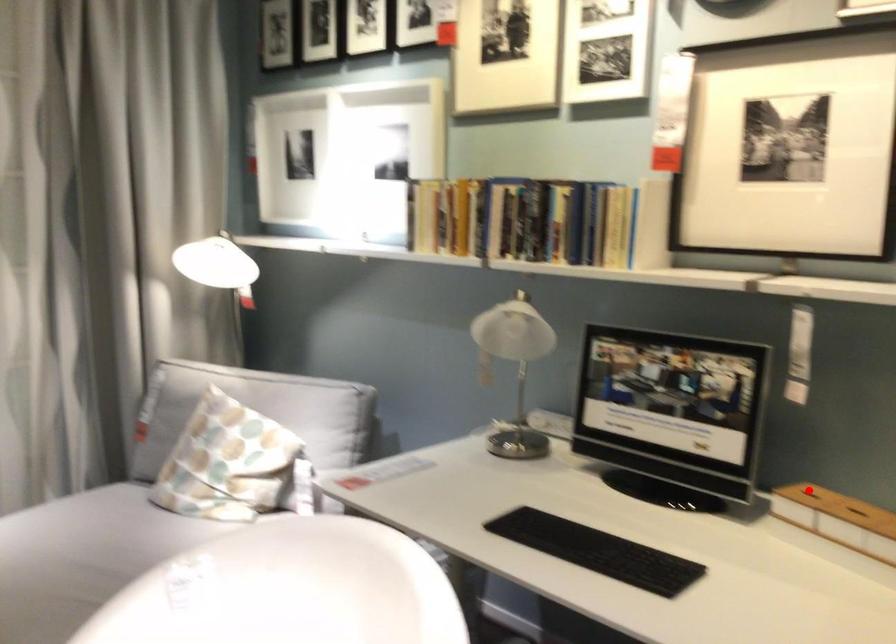
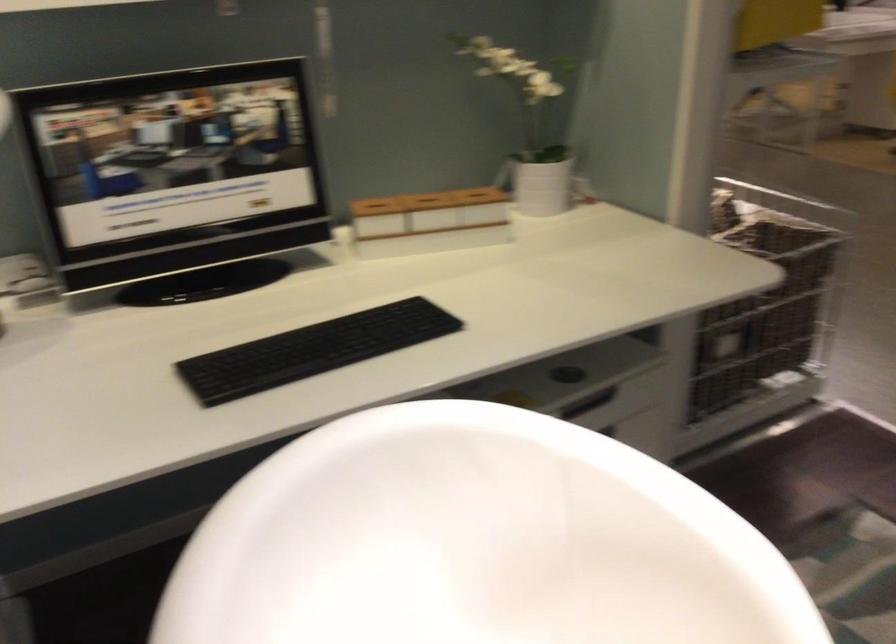
Find the pixel in the second image that matches the highlighted location in the first image.

(375, 204)